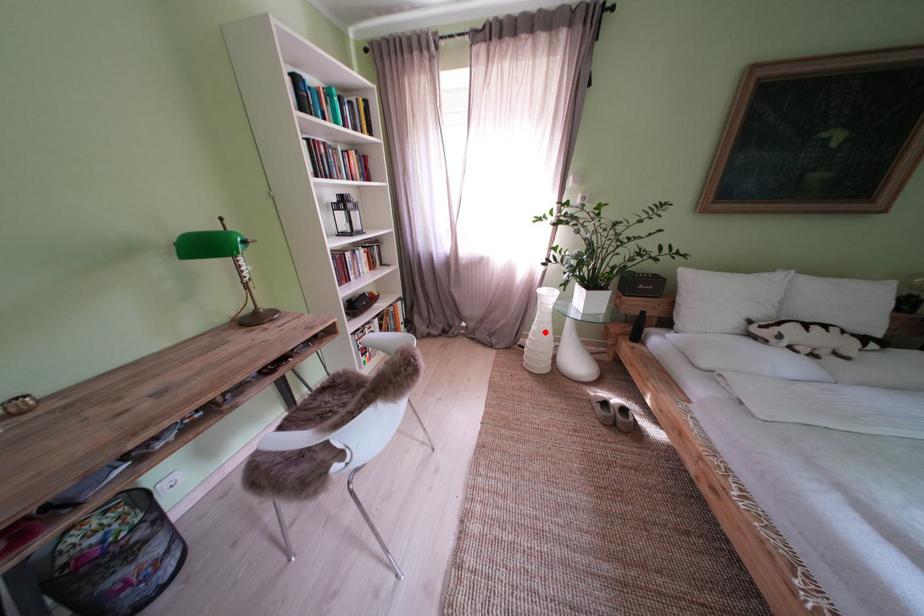
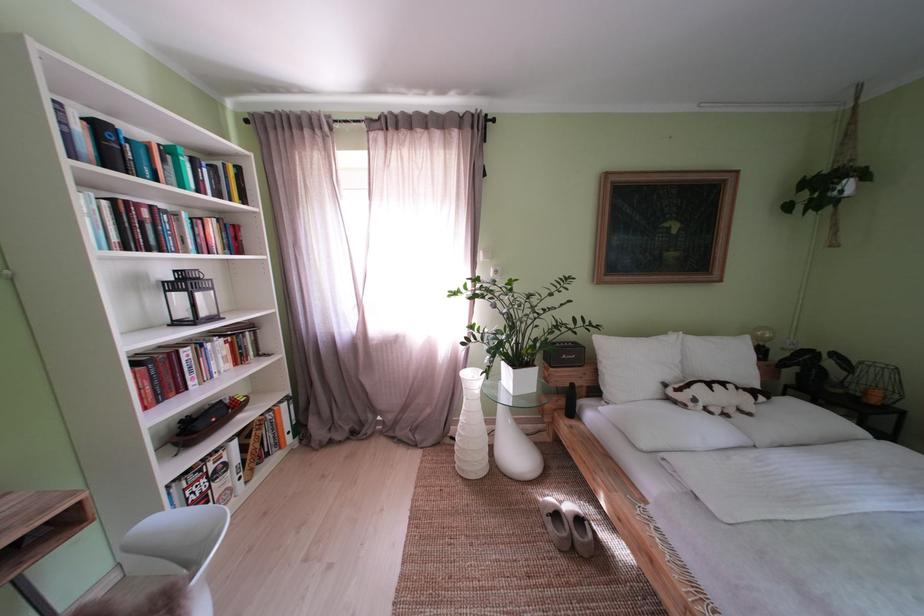
Question: I am providing you with two images of the same scene from different viewpoints. A red point is marked on the first image. Is the red point's position out of view in image 2?

Choices:
 (A) Yes
 (B) No

Answer: (B)